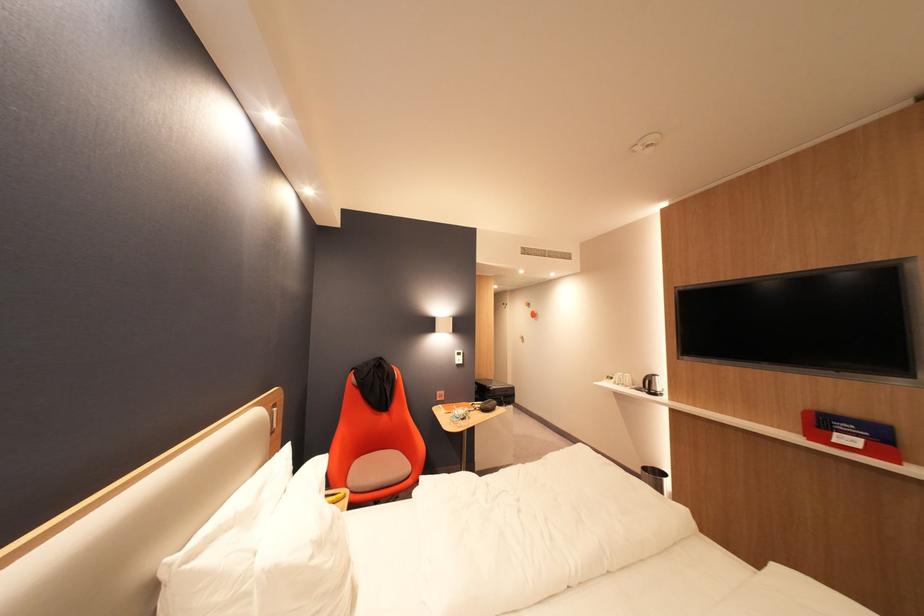
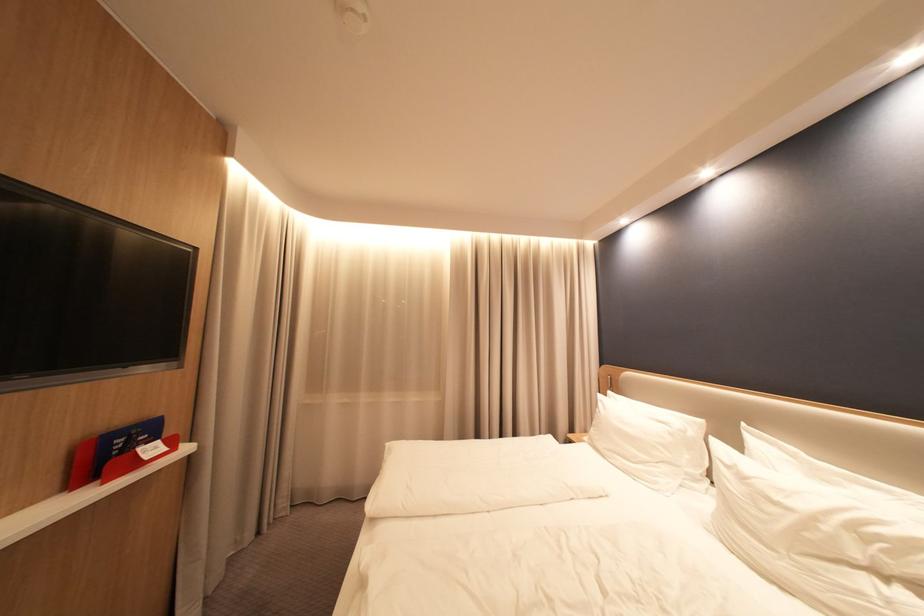
Where in the second image is the point corresponding to the point at 846,435 from the first image?

(150, 452)